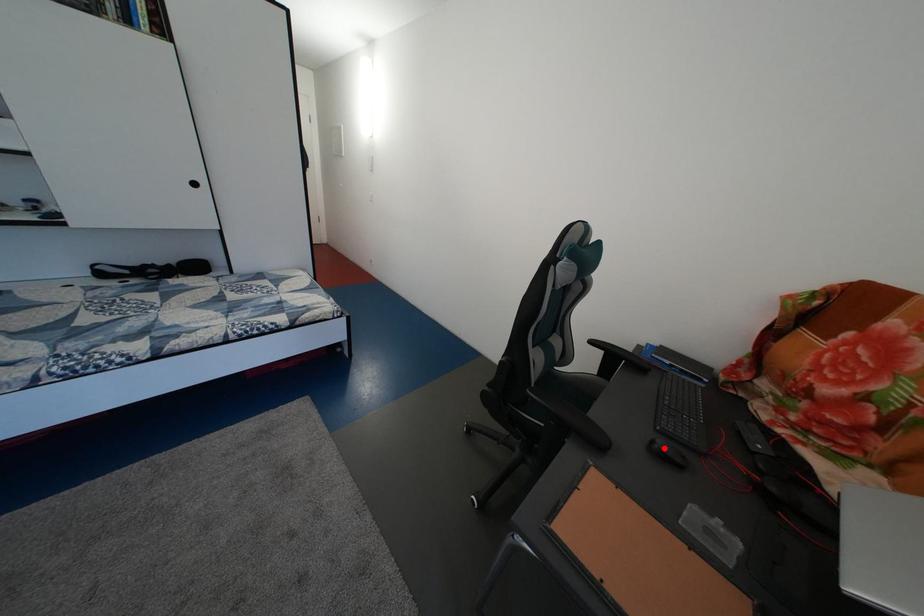
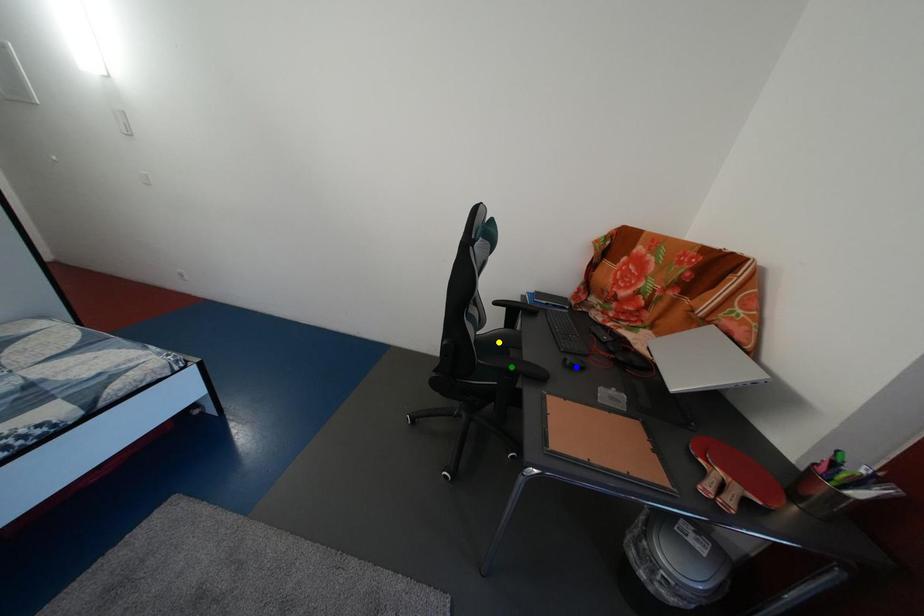
Question: I am providing you with two images of the same scene from different viewpoints. A red point is marked on the first image. You are given multiple points on the second image. Which point in image 2 is actually the same real-world point as the red point in image 1?

Choices:
 (A) yellow point
 (B) blue point
 (C) green point

Answer: (B)